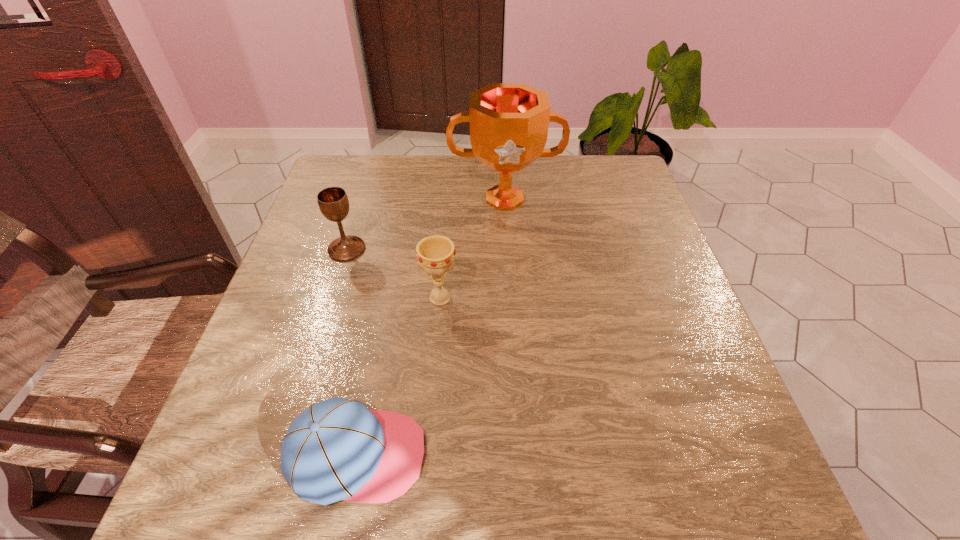
I want to click on vacant space located on the back of the nearer chalice, so click(x=449, y=186).

You are a GUI agent. You are given a task and a screenshot of the screen. Output one action in this format:
    pyautogui.click(x=<x>, y=<y>)
    Task: Click on the vacant area situated on the front-facing side of the baseball cap
    
    Given the screenshot: What is the action you would take?
    pyautogui.click(x=479, y=455)

The width and height of the screenshot is (960, 540). I want to click on object that is at the far edge, so pyautogui.click(x=509, y=122).

This screenshot has height=540, width=960. In order to click on object positioned at the near edge in this screenshot , I will do `click(337, 449)`.

Find the location of a particular element. chalice present at the left edge is located at coordinates (333, 202).

Locate an element on the screen. baseball cap that is positioned at the left edge is located at coordinates (337, 449).

Where is `object that is at the near left corner`? The width and height of the screenshot is (960, 540). object that is at the near left corner is located at coordinates (337, 449).

At what (x,y) coordinates should I click in order to perform the action: click on free location at the far edge. Please return your answer as a coordinate pair (x, y). Image resolution: width=960 pixels, height=540 pixels. Looking at the image, I should click on (468, 183).

In the image, there is a desktop. Identify the location of free space at the left edge. (307, 309).

Where is `free spot at the right edge of the desktop`? Image resolution: width=960 pixels, height=540 pixels. free spot at the right edge of the desktop is located at coordinates (660, 281).